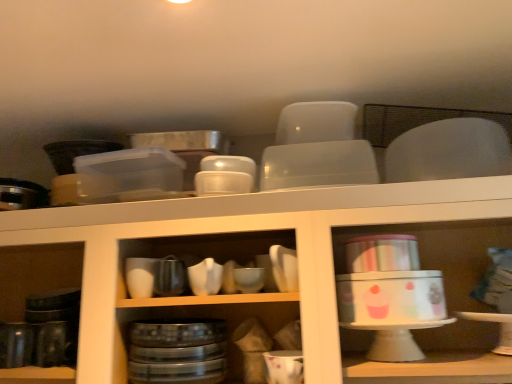
Question: Do you think white glossy cake stand at center, the 2th shelf viewed from the right, is within matte white bowl at center, which appears as the fourth tableware when viewed from the right, or outside of it?

Choices:
 (A) outside
 (B) inside

Answer: (A)

Question: Is point (395, 210) positioned closer to the camera than point (202, 281)?

Choices:
 (A) closer
 (B) farther

Answer: (A)

Question: Estimate the real-world distances between objects in this image. Which object is closer to the matte white bowl at center, the second tableware from the left?

Choices:
 (A) white glossy bowl at center, which appears as the fifth tableware when viewed from the left
 (B) shiny black mug at left, arranged as the 1th tableware when viewed from the left
 (C) white glossy cake stand at center, the 2th shelf viewed from the right
 (D) white glossy bowl at center, which ranks as the third tableware in right-to-left order
 (E) metallic tin canister at right, which ranks as the first shelf in right-to-left order

Answer: (D)

Question: Which of these objects is positioned closest to the white glossy bowl at center, which appears as the fifth tableware when viewed from the left?

Choices:
 (A) metallic tin canister at right, which ranks as the first shelf in right-to-left order
 (B) matte white bowl at center, which appears as the fourth tableware when viewed from the right
 (C) shiny black mug at left, the 5th tableware viewed from the right
 (D) white glossy bowl at center, which ranks as the third tableware in right-to-left order
 (E) white glossy mug at lower center, the second tableware in the right-to-left sequence

Answer: (D)